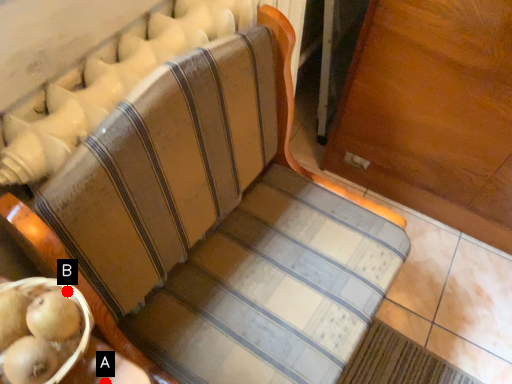
Question: Two points are circled on the image, labeled by A and B beside each circle. Which of the following is the closest to the observer?

Choices:
 (A) A is closer
 (B) B is closer

Answer: (B)